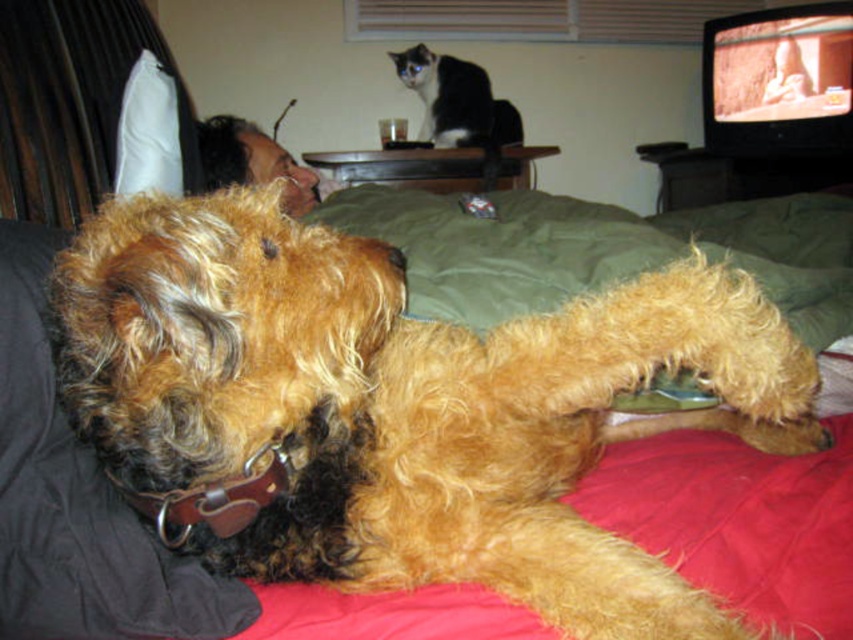
What do you see at coordinates (459, 106) in the screenshot?
I see `black and white fur at upper center` at bounding box center [459, 106].

Is point (421, 56) positioned behind point (178, 195)?

Yes, point (421, 56) is behind point (178, 195).

At what (x,y) coordinates should I click in order to perform the action: click on black and white fur at upper center. Please return your answer as a coordinate pair (x, y). Looking at the image, I should click on (459, 106).

Does fuzzy brown dog at center have a larger size compared to black and white fur at upper center?

Correct, fuzzy brown dog at center is larger in size than black and white fur at upper center.

Does point (267, 356) come in front of point (434, 92)?

Yes, point (267, 356) is in front of point (434, 92).

The height and width of the screenshot is (640, 853). What are the coordinates of `fuzzy brown dog at center` in the screenshot? It's located at (403, 404).

Based on the photo, can you confirm if fuzzy brown dog at center is positioned to the left of white fabric pillow at upper left?

In fact, fuzzy brown dog at center is to the right of white fabric pillow at upper left.

Who is more distant from viewer, (474,337) or (169,81)?

The point (169,81) is more distant.

Does point (241, 260) lie in front of point (163, 116)?

That is True.

Where is `fuzzy brown dog at center`? Image resolution: width=853 pixels, height=640 pixels. fuzzy brown dog at center is located at coordinates (403, 404).